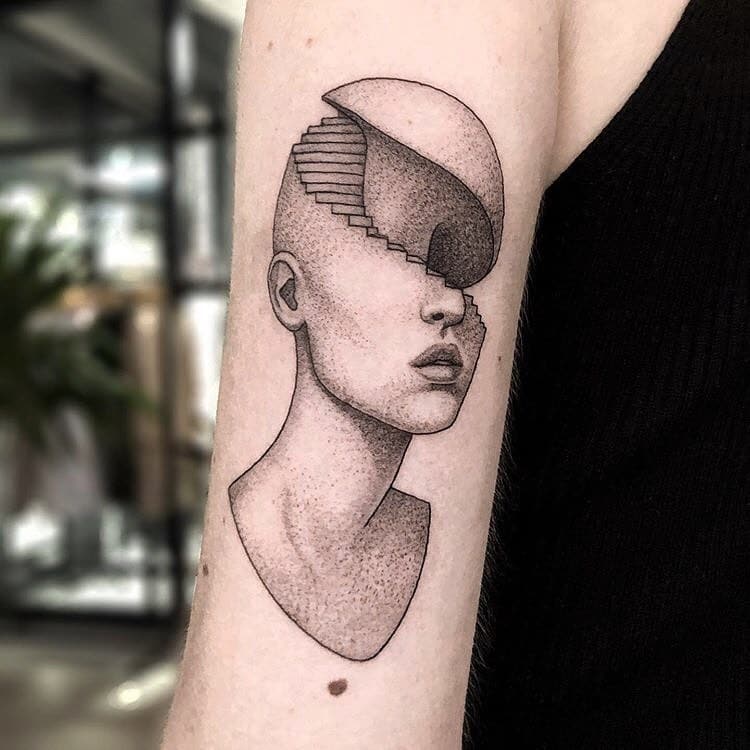
Find the location of `stair`. stair is located at coordinates (342, 153).